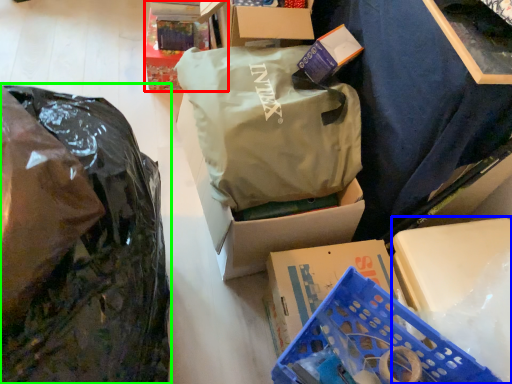
Question: Which object is positioned closest to box (highlighted by a red box)? Select from storage box (highlighted by a blue box) and plastic bag (highlighted by a green box).

Choices:
 (A) storage box
 (B) plastic bag

Answer: (B)